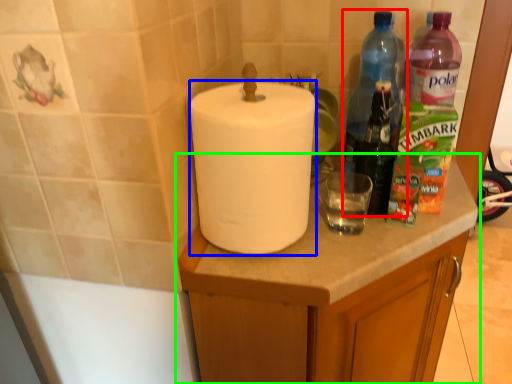
Question: Which is farther away from bottle (highlighted by a red box)? paper towel (highlighted by a blue box) or cabinetry (highlighted by a green box)?

Choices:
 (A) paper towel
 (B) cabinetry

Answer: (A)